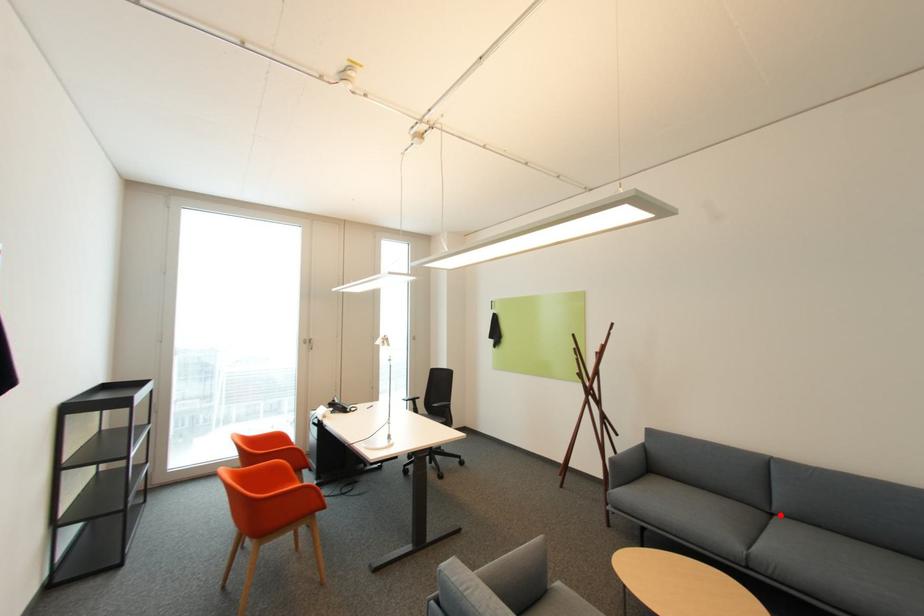
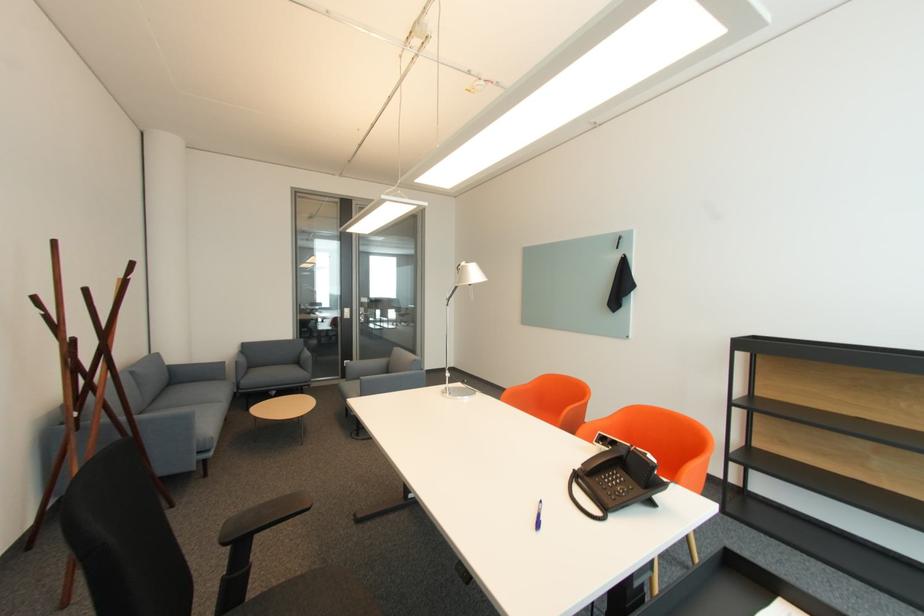
Locate, in the second image, the point that corresponds to the highlighted location in the first image.

(151, 411)